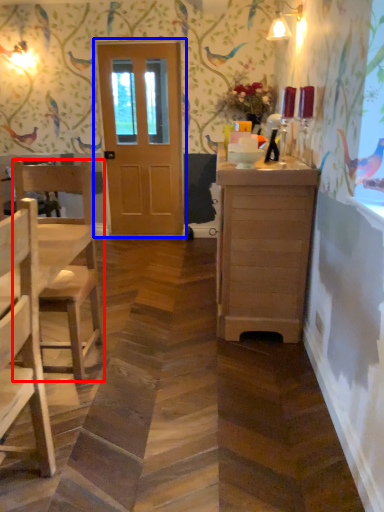
Question: Which point is further to the camera, chair (highlighted by a red box) or door (highlighted by a blue box)?

Choices:
 (A) chair
 (B) door

Answer: (B)